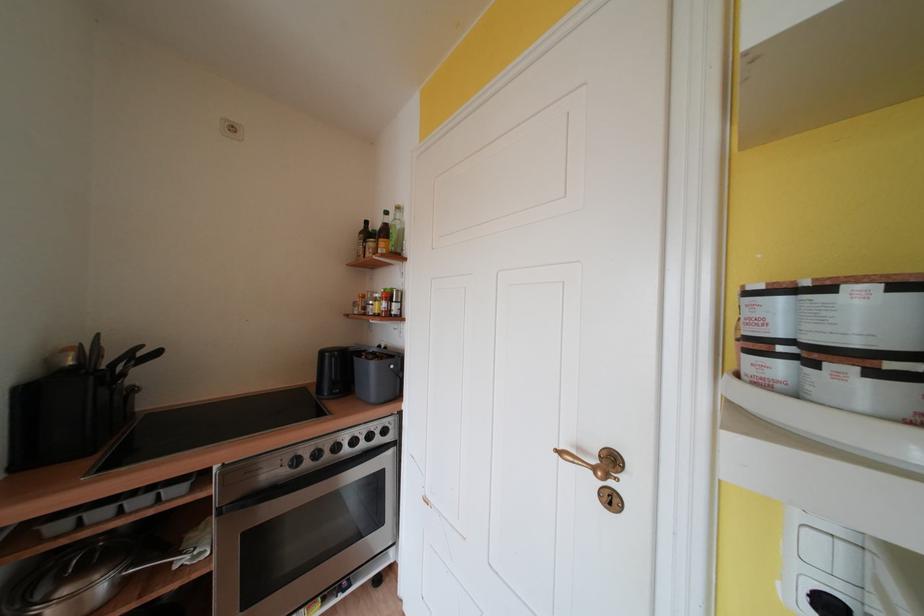
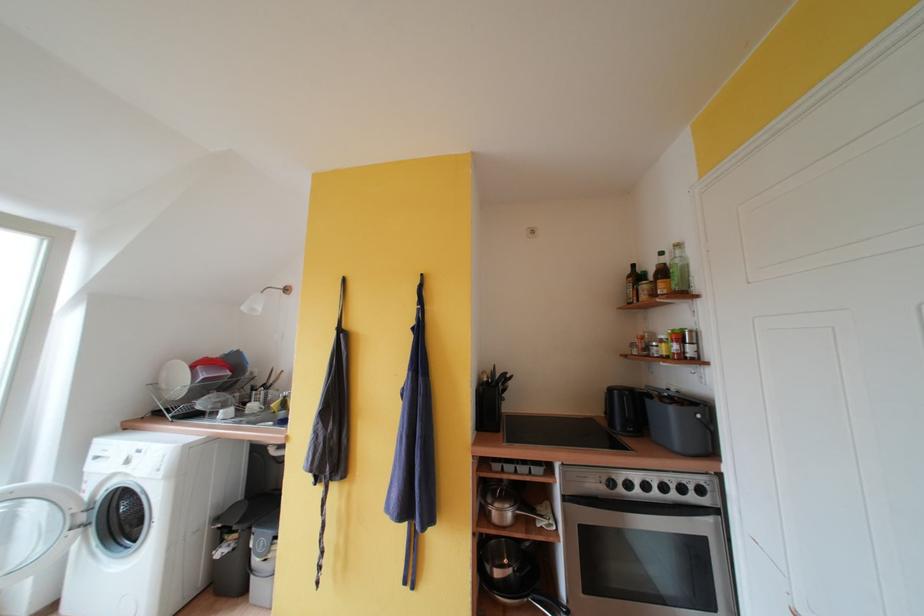
Locate, in the second image, the point that corresponds to [181,570] in the first image.

(544, 529)